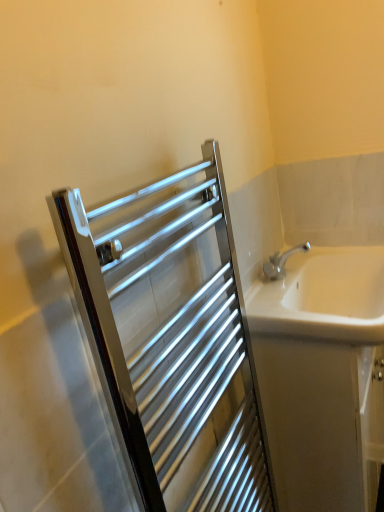
Question: Looking at the image, does polished chrome towel rack at upper left seem bigger or smaller compared to white ceramic sink at right?

Choices:
 (A) big
 (B) small

Answer: (A)

Question: Considering the positions of polished chrome towel rack at upper left and white ceramic sink at right in the image, is polished chrome towel rack at upper left taller or shorter than white ceramic sink at right?

Choices:
 (A) tall
 (B) short

Answer: (A)

Question: Which object is positioned closest to the polished chrome towel rack at upper left?

Choices:
 (A) white glossy bathtub at right
 (B) white ceramic sink at right

Answer: (A)

Question: Based on their relative distances, which object is nearer to the polished chrome towel rack at upper left?

Choices:
 (A) white ceramic sink at right
 (B) white glossy bathtub at right

Answer: (B)